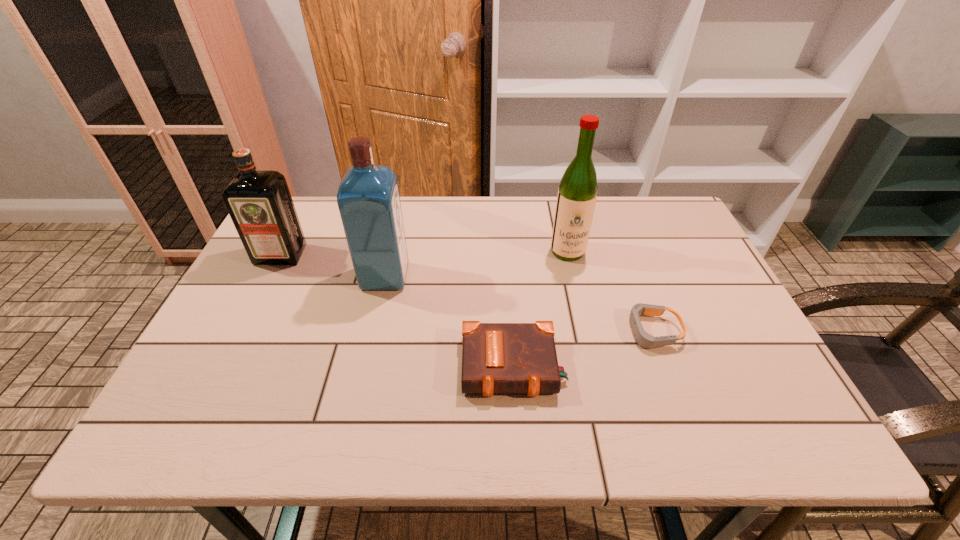
Locate an element on the screen. The width and height of the screenshot is (960, 540). the rightmost liquor is located at coordinates (577, 193).

Image resolution: width=960 pixels, height=540 pixels. Find the location of `the second liquor from left to right`. the second liquor from left to right is located at coordinates click(x=368, y=199).

At what (x,y) coordinates should I click in order to perform the action: click on the shortest liquor. Please return your answer as a coordinate pair (x, y). Image resolution: width=960 pixels, height=540 pixels. Looking at the image, I should click on (259, 202).

You are a GUI agent. You are given a task and a screenshot of the screen. Output one action in this format:
    pyautogui.click(x=<x>, y=<y>)
    Task: Click on the leftmost liquor
    Image resolution: width=960 pixels, height=540 pixels.
    Given the screenshot: What is the action you would take?
    pyautogui.click(x=259, y=202)

Find the location of a particular element. This screenshot has height=540, width=960. the third object from left to right is located at coordinates (497, 358).

You are a GUI agent. You are given a task and a screenshot of the screen. Output one action in this format:
    pyautogui.click(x=<x>, y=<y>)
    Task: Click on the Bible
    The height and width of the screenshot is (540, 960).
    Given the screenshot: What is the action you would take?
    pyautogui.click(x=497, y=358)

Find the location of a particular element. The width and height of the screenshot is (960, 540). the shortest object is located at coordinates [644, 339].

Locate an element on the screen. This screenshot has width=960, height=540. the rightmost object is located at coordinates (644, 339).

Locate an element on the screen. The image size is (960, 540). vacant space located 0.220m on the label of the rightmost liquor is located at coordinates (584, 321).

Locate an element on the screen. vacant space situated on the flat label side of the second object from left to right is located at coordinates (510, 277).